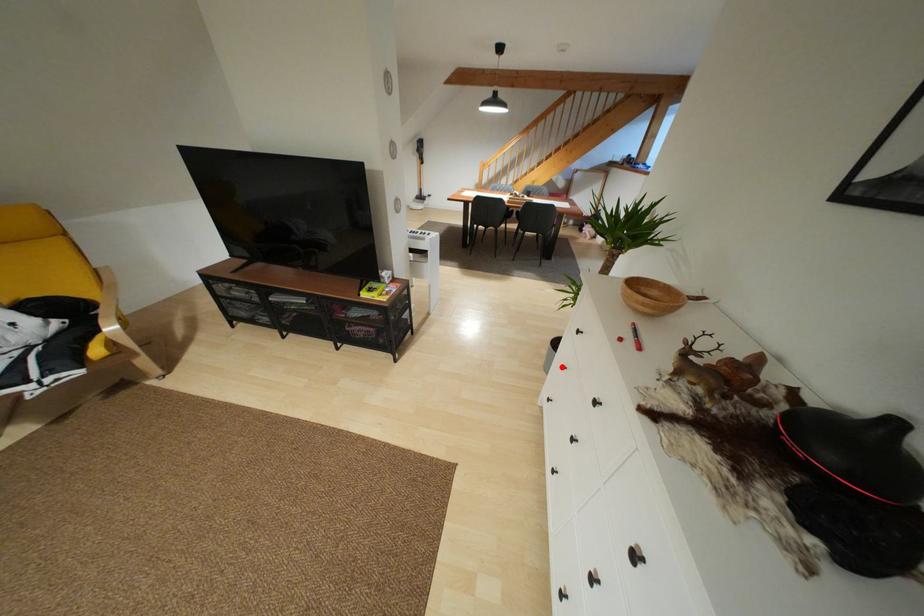
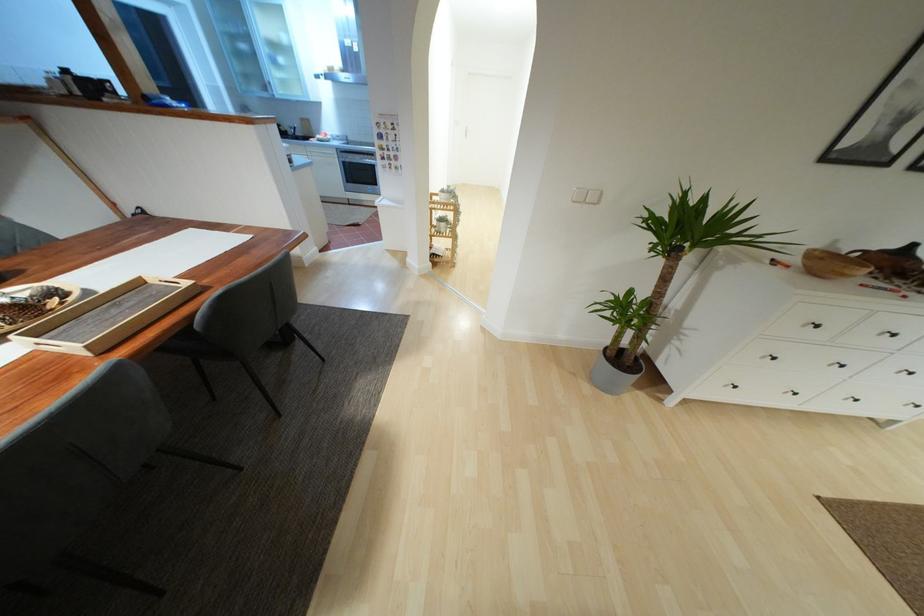
Question: I am providing you with two images of the same scene from different viewpoints. Given a red point in image1, look at the same physical point in image2. Is it:

Choices:
 (A) Closer to the viewpoint
 (B) Farther from the viewpoint

Answer: (B)